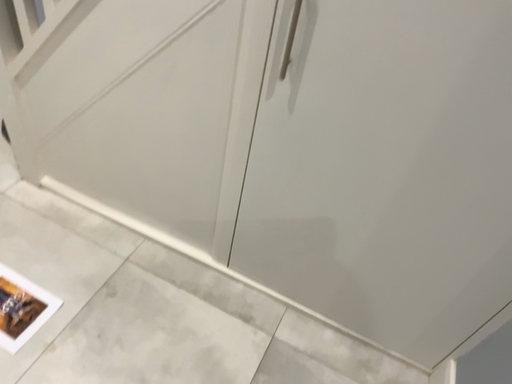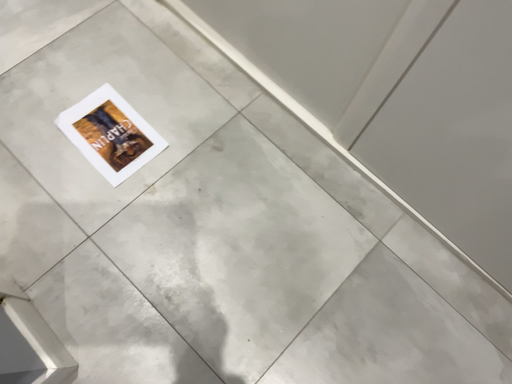
Question: How did the camera likely rotate when shooting the video?

Choices:
 (A) rotated downward
 (B) rotated upward

Answer: (A)